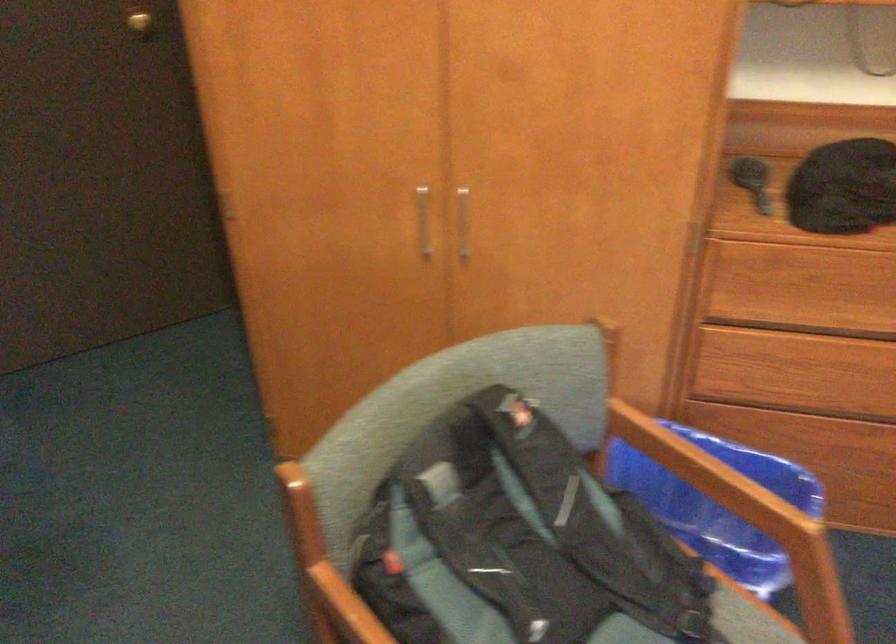
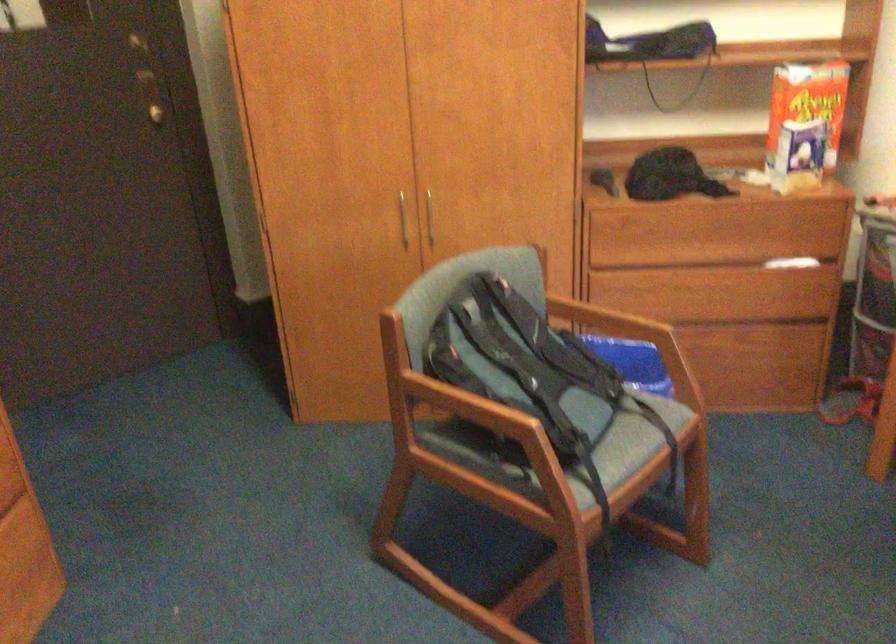
Which direction would the cameraman need to move to produce the second image?

The movement direction of the cameraman is left, backward.